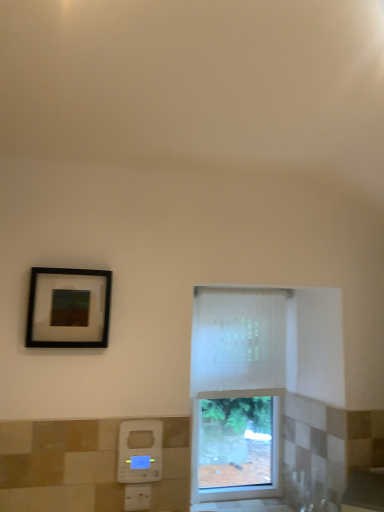
Locate an element on the screen. white plastic hand dryer at lower center is located at coordinates (140, 451).

Consider the image. Measure the distance between white sheer curtain at center and camera.

white sheer curtain at center is 1.81 meters away from camera.

In order to face white textured window at center, should I rotate leftwards or rightwards?

Turn right by 6.372 degrees to look at white textured window at center.

In order to click on white textured window at center in this screenshot , I will do pos(237,392).

Find the location of a particular element. The width and height of the screenshot is (384, 512). white plastic hand dryer at lower center is located at coordinates (140, 451).

Is white textured window at center inside or outside of white plastic hand dryer at lower center?

white textured window at center is outside white plastic hand dryer at lower center.

The width and height of the screenshot is (384, 512). I want to click on hand dryer that is in front of the white textured window at center, so click(x=140, y=451).

Could you tell me if white textured window at center is facing white plastic hand dryer at lower center?

No, white textured window at center does not turn towards white plastic hand dryer at lower center.

Consider the image. How distant is white sheer curtain at center from white plastic hand dryer at lower center?

They are 21.87 inches apart.

From the image's perspective, does white sheer curtain at center appear lower than white plastic hand dryer at lower center?

No.

Where is `hand dryer in front of the white sheer curtain at center`? This screenshot has height=512, width=384. hand dryer in front of the white sheer curtain at center is located at coordinates (140, 451).

Looking at this image, is white sheer curtain at center at the right side of white plastic hand dryer at lower center?

Yes, white sheer curtain at center is to the right of white plastic hand dryer at lower center.

Between white textured window at center and white sheer curtain at center, which one appears on the left side from the viewer's perspective?

white textured window at center is more to the left.

This screenshot has width=384, height=512. Identify the location of curtain above the white textured window at center (from the image's perspective). (238, 339).

Considering their positions, is white textured window at center located in front of or behind white sheer curtain at center?

Visually, white textured window at center is located in front of white sheer curtain at center.

Is white textured window at center inside the boundaries of white sheer curtain at center, or outside?

white textured window at center fits inside white sheer curtain at center.

Is point (78, 332) farther from camera compared to point (201, 352)?

No, it is not.

Is matte black picture frame at upper left further to the viewer compared to white sheer curtain at center?

No.

From the image's perspective, which one is positioned higher, matte black picture frame at upper left or white sheer curtain at center?

matte black picture frame at upper left, from the image's perspective.

Between matte black picture frame at upper left and white sheer curtain at center, which one has smaller width?

Thinner between the two is matte black picture frame at upper left.

Is the position of white plastic hand dryer at lower center more distant than that of matte black picture frame at upper left?

Yes, white plastic hand dryer at lower center is further from the camera.

Is white plastic hand dryer at lower center next to matte black picture frame at upper left?

No, white plastic hand dryer at lower center is not beside matte black picture frame at upper left.

Do you think white plastic hand dryer at lower center is within matte black picture frame at upper left, or outside of it?

white plastic hand dryer at lower center is not inside matte black picture frame at upper left, it's outside.

Does white plastic hand dryer at lower center have a larger size compared to matte black picture frame at upper left?

No, white plastic hand dryer at lower center is not bigger than matte black picture frame at upper left.

Is point (83, 325) in front of point (127, 424)?

Yes.

Locate an element on the screen. Image resolution: width=384 pixels, height=512 pixels. hand dryer located on the right of matte black picture frame at upper left is located at coordinates (140, 451).

Is matte black picture frame at upper left positioned before white plastic hand dryer at lower center?

Yes, matte black picture frame at upper left is closer to the camera.

Is white plastic hand dryer at lower center surrounded by matte black picture frame at upper left?

No, matte black picture frame at upper left does not contain white plastic hand dryer at lower center.

Locate an element on the screen. This screenshot has height=512, width=384. hand dryer that appears on the left of white textured window at center is located at coordinates (140, 451).

Can you tell me how much white plastic hand dryer at lower center and white textured window at center differ in facing direction?

The angle between the facing direction of white plastic hand dryer at lower center and the facing direction of white textured window at center is 1.02 degrees.

How distant is white plastic hand dryer at lower center from white textured window at center?

They are 21.45 inches apart.

Can you confirm if white plastic hand dryer at lower center is taller than white textured window at center?

No, white plastic hand dryer at lower center is not taller than white textured window at center.

The height and width of the screenshot is (512, 384). In the image, there is a white plastic hand dryer at lower center. In order to click on window above it (from the image's perspective) in this screenshot , I will do (x=237, y=392).

The image size is (384, 512). I want to click on hand dryer in front of the white sheer curtain at center, so click(x=140, y=451).

When comparing their distances from white sheer curtain at center, does white textured window at center or white plastic hand dryer at lower center seem closer?

Among the two, white textured window at center is located nearer to white sheer curtain at center.

Looking at the image, which one is located further to white plastic hand dryer at lower center, matte black picture frame at upper left or white sheer curtain at center?

white sheer curtain at center is positioned further to the anchor white plastic hand dryer at lower center.

Considering their positions, is matte black picture frame at upper left positioned closer to white sheer curtain at center than white textured window at center?

white textured window at center is positioned closer to the anchor white sheer curtain at center.

Based on their spatial positions, is white sheer curtain at center or matte black picture frame at upper left closer to white plastic hand dryer at lower center?

matte black picture frame at upper left lies closer to white plastic hand dryer at lower center than the other object.

When comparing their distances from white textured window at center, does white plastic hand dryer at lower center or white sheer curtain at center seem further?

The object further to white textured window at center is white plastic hand dryer at lower center.

From the image, which object appears to be nearer to white textured window at center, white plastic hand dryer at lower center or matte black picture frame at upper left?

The object closer to white textured window at center is white plastic hand dryer at lower center.

Based on their spatial positions, is white sheer curtain at center or white plastic hand dryer at lower center closer to white textured window at center?

white sheer curtain at center is closer to white textured window at center.

When comparing their distances from white plastic hand dryer at lower center, does white textured window at center or matte black picture frame at upper left seem closer?

matte black picture frame at upper left is closer to white plastic hand dryer at lower center.

Identify the location of window between white plastic hand dryer at lower center and white sheer curtain at center from front to back. This screenshot has height=512, width=384. (237, 392).

Where is `hand dryer between matte black picture frame at upper left and white textured window at center`? This screenshot has width=384, height=512. hand dryer between matte black picture frame at upper left and white textured window at center is located at coordinates (140, 451).

Where is `hand dryer between matte black picture frame at upper left and white sheer curtain at center from left to right`? The height and width of the screenshot is (512, 384). hand dryer between matte black picture frame at upper left and white sheer curtain at center from left to right is located at coordinates (140, 451).

At what (x,y) coordinates should I click in order to perform the action: click on window situated between matte black picture frame at upper left and white sheer curtain at center from left to right. Please return your answer as a coordinate pair (x, y). Looking at the image, I should click on (237, 392).